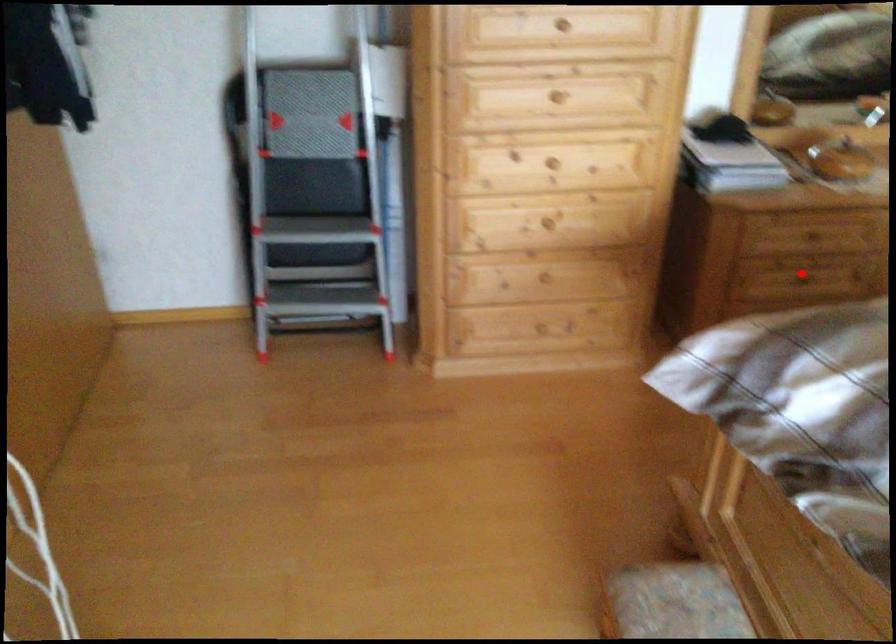
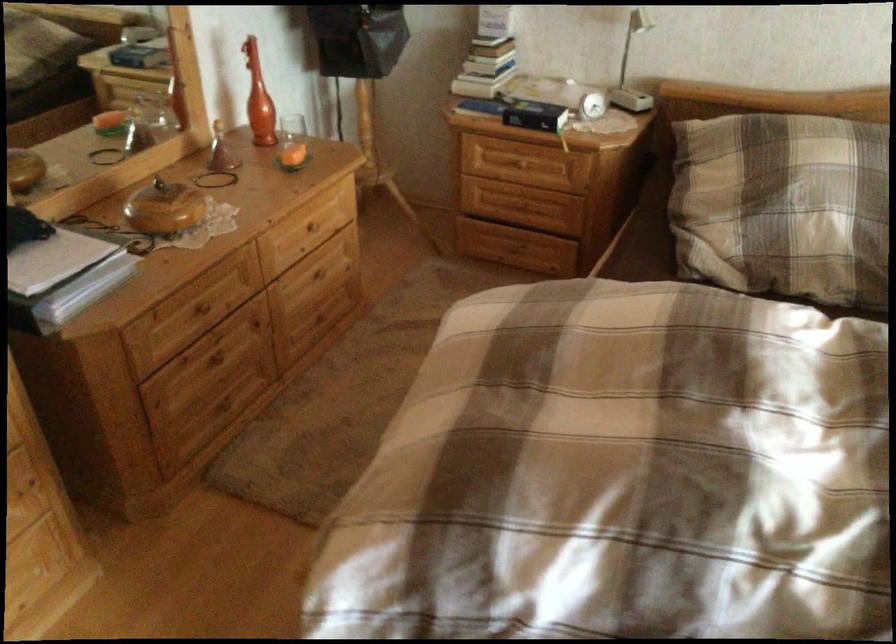
Question: I am providing you with two images of the same scene from different viewpoints. Image1 has a red point marked. In image2, the corresponding 3D location appears at what relative position? Reply with the corresponding letter.

Choices:
 (A) Closer
 (B) Farther

Answer: (A)